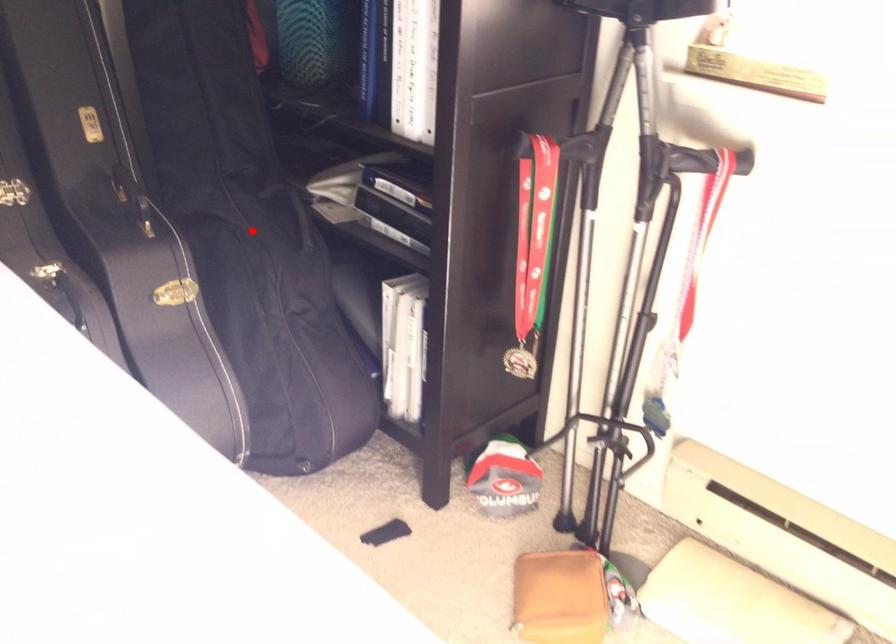
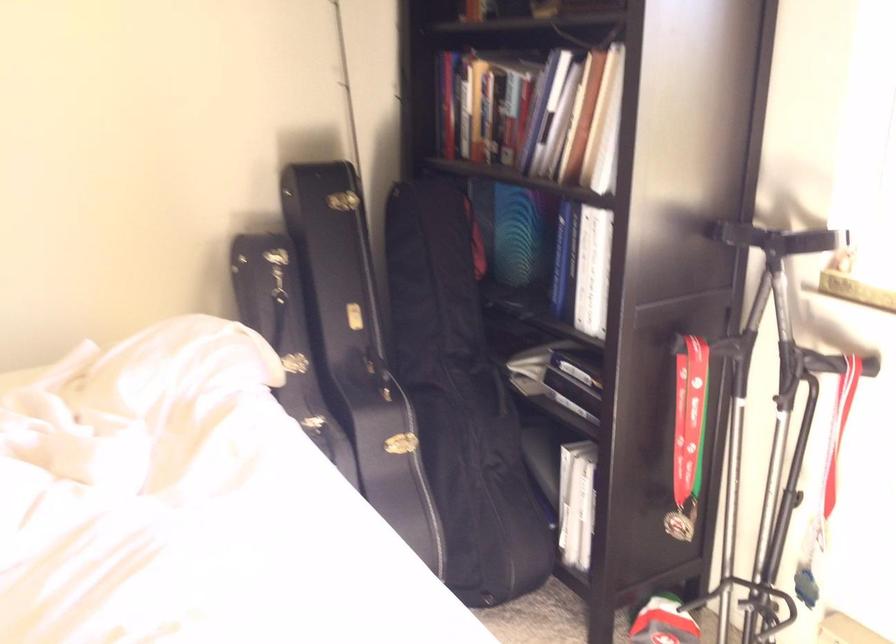
Question: A red point is marked in image1. In image2, is the corresponding 3D point closer to the camera or farther? Reply with the corresponding letter.

Choices:
 (A) The corresponding 3D point is closer.
 (B) The corresponding 3D point is farther.

Answer: (B)